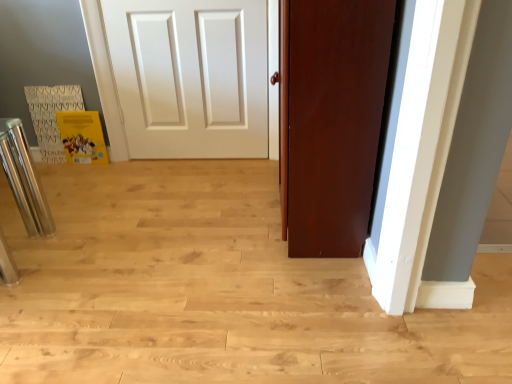
Question: Is matte brown door at center shorter than shiny metallic bar stool at left?

Choices:
 (A) yes
 (B) no

Answer: (B)

Question: Can you confirm if matte brown door at center is smaller than shiny metallic bar stool at left?

Choices:
 (A) no
 (B) yes

Answer: (A)

Question: Is matte brown door at center positioned with its back to shiny metallic bar stool at left?

Choices:
 (A) yes
 (B) no

Answer: (B)

Question: From the image's perspective, is matte brown door at center above shiny metallic bar stool at left?

Choices:
 (A) no
 (B) yes

Answer: (B)

Question: Is matte brown door at center surrounding shiny metallic bar stool at left?

Choices:
 (A) no
 (B) yes

Answer: (A)

Question: Considering the relative positions of matte brown door at center and shiny metallic bar stool at left in the image provided, is matte brown door at center to the left of shiny metallic bar stool at left from the viewer's perspective?

Choices:
 (A) no
 (B) yes

Answer: (A)

Question: Are shiny metallic bar stool at left and matte brown door at center beside each other?

Choices:
 (A) yes
 (B) no

Answer: (B)

Question: Would you say shiny metallic bar stool at left is outside matte brown door at center?

Choices:
 (A) no
 (B) yes

Answer: (B)

Question: Considering the relative sizes of shiny metallic bar stool at left and matte brown door at center in the image provided, is shiny metallic bar stool at left bigger than matte brown door at center?

Choices:
 (A) no
 (B) yes

Answer: (A)

Question: Considering the relative sizes of shiny metallic bar stool at left and matte brown door at center in the image provided, is shiny metallic bar stool at left thinner than matte brown door at center?

Choices:
 (A) yes
 (B) no

Answer: (B)

Question: Is shiny metallic bar stool at left behind matte brown door at center?

Choices:
 (A) yes
 (B) no

Answer: (A)

Question: From a real-world perspective, is shiny metallic bar stool at left below matte brown door at center?

Choices:
 (A) no
 (B) yes

Answer: (B)

Question: Considering their positions, is shiny metallic bar stool at left located in front of or behind matte brown door at center?

Choices:
 (A) behind
 (B) front

Answer: (A)